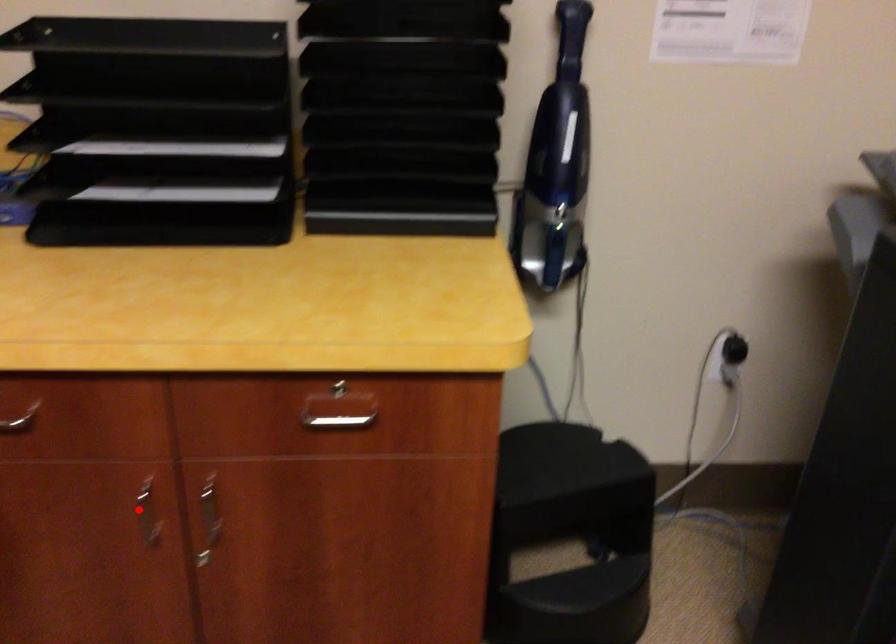
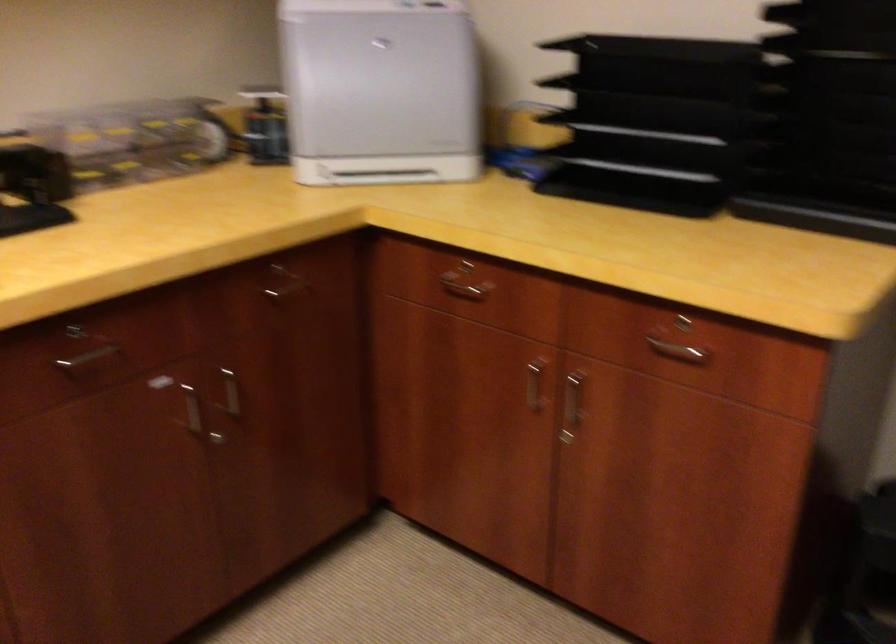
Question: I am providing you with two images of the same scene from different viewpoints. In image1, a red point is highlighted. Considering the same 3D point in image2, which of the following is correct?

Choices:
 (A) It is closer
 (B) It is farther

Answer: (B)